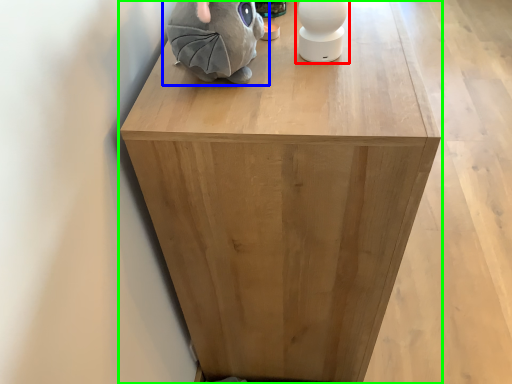
Question: Which object is the closest to the toy (highlighted by a red box)? Choose among these: toy (highlighted by a blue box) or furniture (highlighted by a green box).

Choices:
 (A) toy
 (B) furniture

Answer: (A)